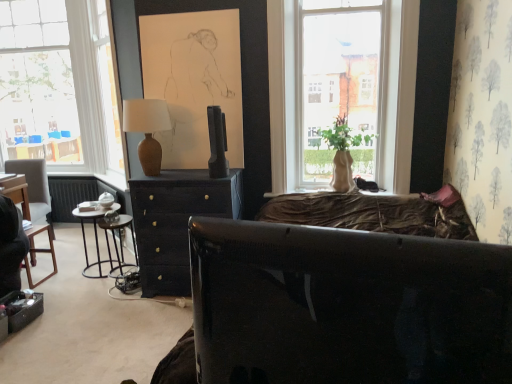
Question: Relative to matte beige vase at window, is glossy black studio couch at center in front or behind?

Choices:
 (A) behind
 (B) front

Answer: (B)

Question: In terms of width, does glossy black studio couch at center look wider or thinner when compared to matte beige vase at window?

Choices:
 (A) wide
 (B) thin

Answer: (B)

Question: Estimate the real-world distances between objects in this image. Which object is farther from the metallic bar stool at left, placed as the 1th bar stool when sorted from right to left?

Choices:
 (A) wooden bar stool at lower left, acting as the first bar stool starting from the left
 (B) matte beige vase at window
 (C) matte dark wood dresser at center
 (D) metallic black nightstand at left
 (E) slate gray stone television at center

Answer: (B)

Question: Estimate the real-world distances between objects in this image. Which object is closer to the dark gray fabric chair at left?

Choices:
 (A) glossy black studio couch at center
 (B) matte brown vase at center
 (C) matte beige vase at window
 (D) metallic black nightstand at left
 (E) slate gray stone television at center

Answer: (D)